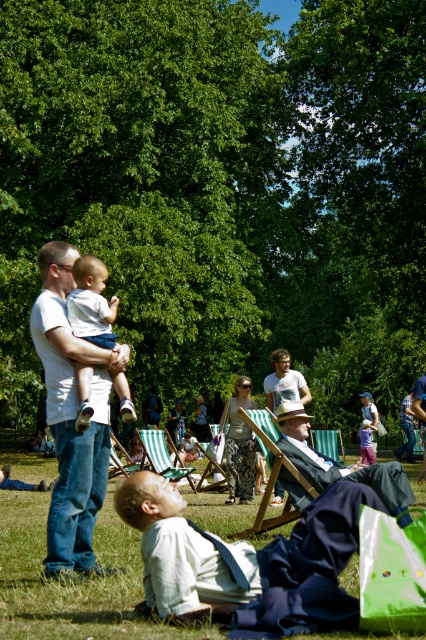
Question: Which point appears farthest from the camera in this image?

Choices:
 (A) (88, 417)
 (B) (89, 509)
 (C) (287, 397)
 (D) (32, 621)

Answer: (C)

Question: Among these points, which one is farthest from the camera?

Choices:
 (A) (55, 445)
 (B) (157, 444)

Answer: (B)

Question: Which object is positioned farthest from the light brown leather chair at center?

Choices:
 (A) green striped beach chair at center
 (B) matte white baby at center
 (C) green grass at lower center
 (D) green fabric deck chair at center

Answer: (A)

Question: Is green grass at lower center in front of light brown hair at center?

Choices:
 (A) yes
 (B) no

Answer: (A)

Question: Does white t-shirt at left appear over light brown hair at center?

Choices:
 (A) no
 (B) yes

Answer: (B)

Question: From the image, what is the correct spatial relationship of white t-shirt at left in relation to light brown leather chair at center?

Choices:
 (A) right
 (B) left

Answer: (B)